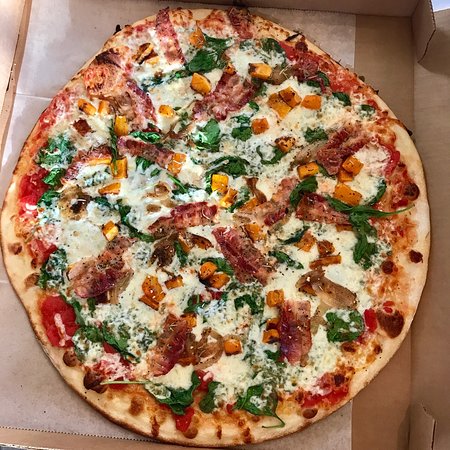
The width and height of the screenshot is (450, 450). In order to click on table in this screenshot , I will do `click(436, 16)`.